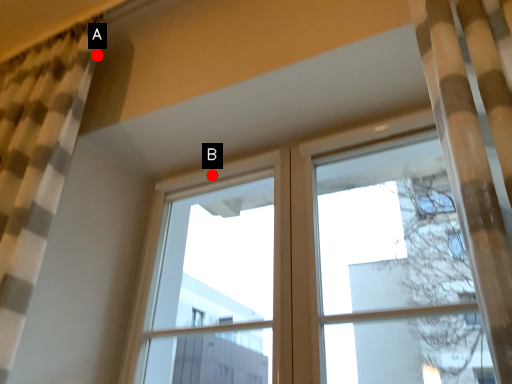
Question: Two points are circled on the image, labeled by A and B beside each circle. Which point is closer to the camera?

Choices:
 (A) A is closer
 (B) B is closer

Answer: (A)